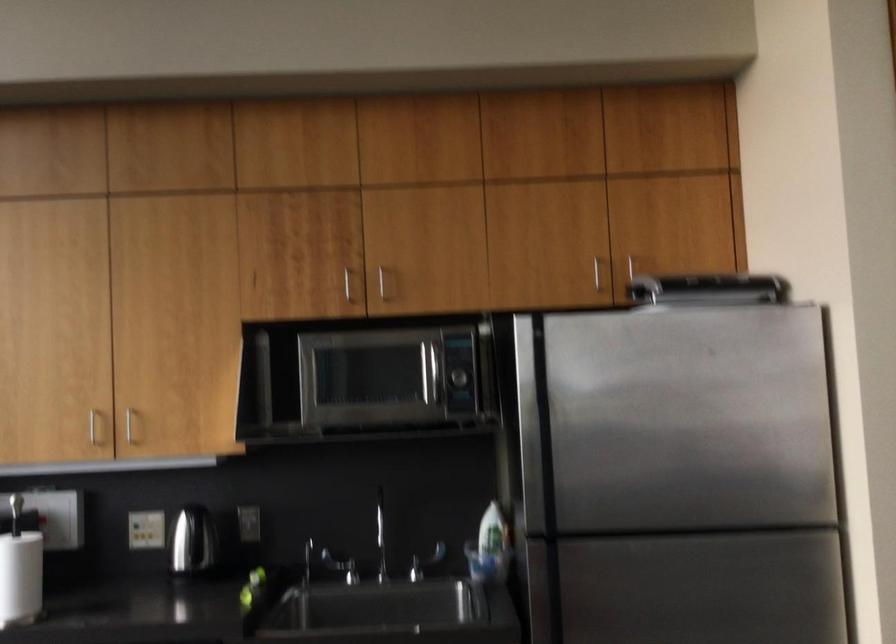
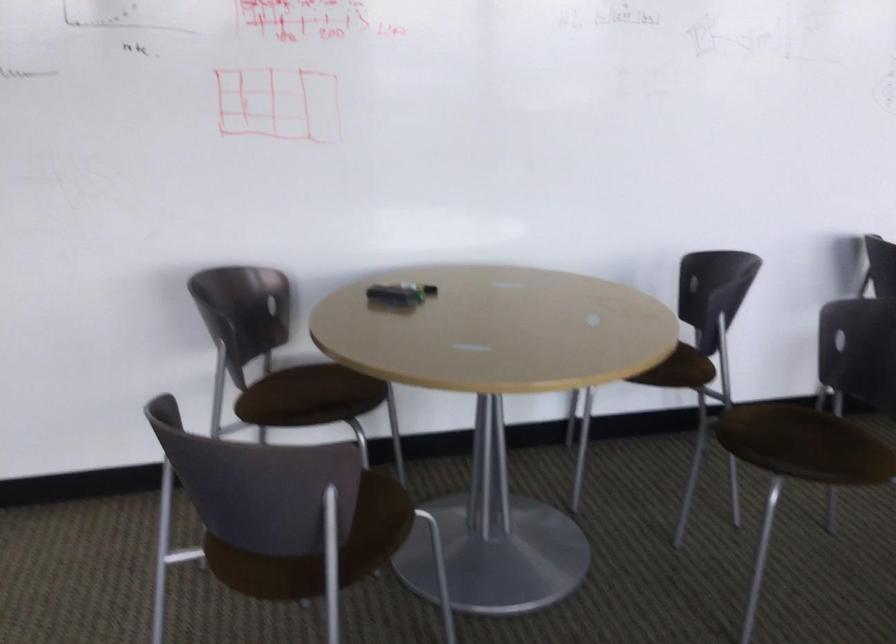
Question: The images are taken continuously from a first-person perspective. In which direction is your viewpoint rotating?

Choices:
 (A) Left
 (B) Right
 (C) Up
 (D) Down

Answer: (B)